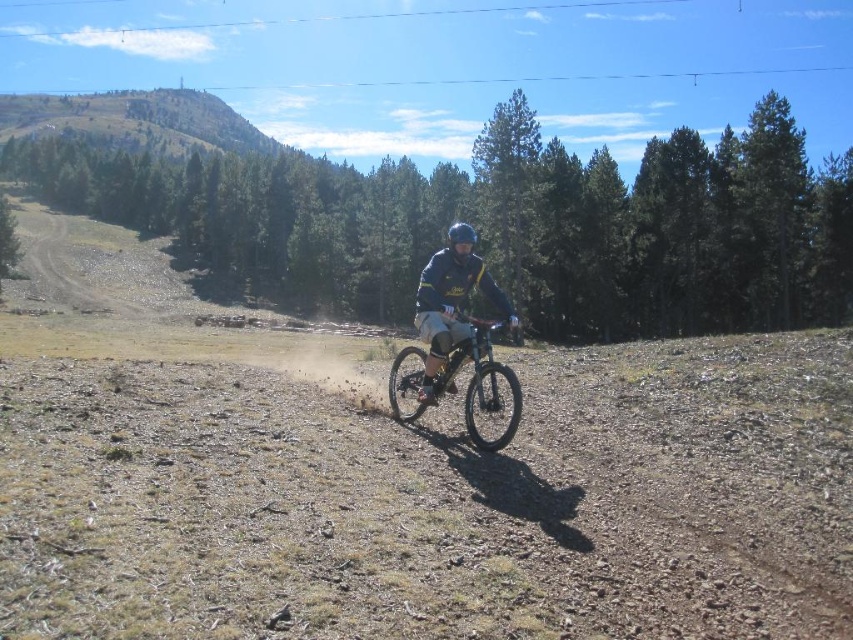
Question: Among these objects, which one is nearest to the camera?

Choices:
 (A) dark blue jersey at center
 (B) shiny metallic bicycle at center

Answer: (B)

Question: Is shiny metallic bicycle at center positioned before dark blue jersey at center?

Choices:
 (A) no
 (B) yes

Answer: (B)

Question: Does shiny metallic bicycle at center have a smaller size compared to dark blue jersey at center?

Choices:
 (A) no
 (B) yes

Answer: (B)

Question: Is shiny metallic bicycle at center positioned in front of dark blue jersey at center?

Choices:
 (A) no
 (B) yes

Answer: (B)

Question: Which object appears closest to the camera in this image?

Choices:
 (A) dark blue jersey at center
 (B) shiny metallic bicycle at center

Answer: (B)

Question: Which of the following is the farthest from the observer?

Choices:
 (A) shiny metallic bicycle at center
 (B) dark blue jersey at center

Answer: (B)